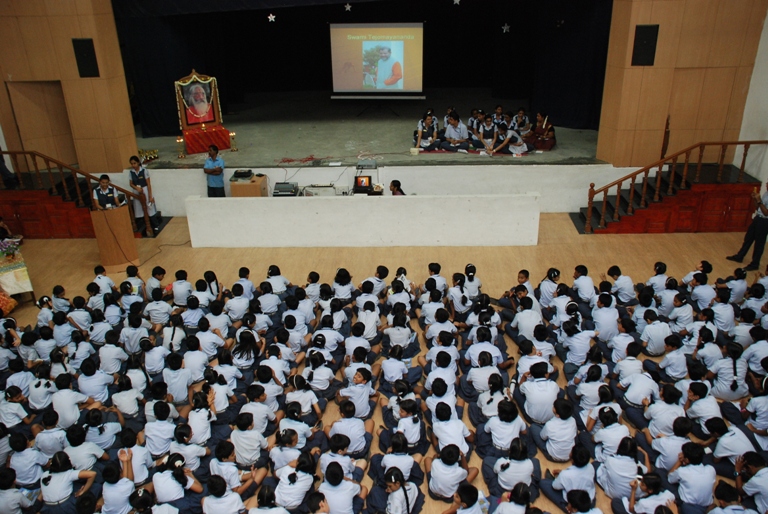
Image resolution: width=768 pixels, height=514 pixels. What are the coordinates of `tablecloth` in the screenshot? It's located at 15,272.